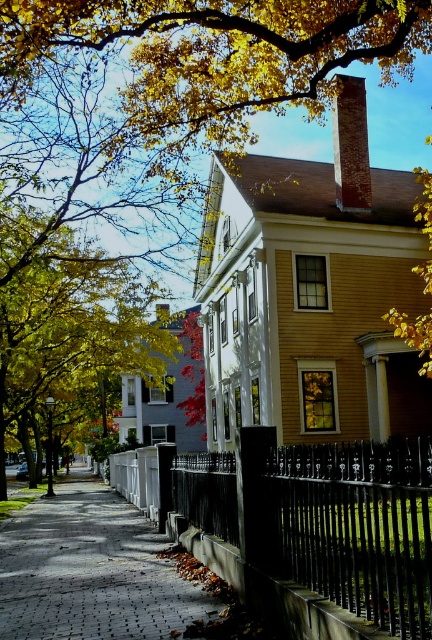
Question: Which point appears farthest from the camera in this image?

Choices:
 (A) (25, 216)
 (B) (47, 620)

Answer: (A)

Question: Is golden leafy tree at upper left below yellow-green foliage at center?

Choices:
 (A) no
 (B) yes

Answer: (A)

Question: Does golden leafy tree at upper left appear under paved brick sidewalk at center?

Choices:
 (A) no
 (B) yes

Answer: (A)

Question: Which of these objects is positioned farthest from the yellow-green foliage at center?

Choices:
 (A) golden leafy tree at upper left
 (B) brick chimney at upper right

Answer: (B)

Question: Is paved brick sidewalk at center to the right of brick chimney at upper right from the viewer's perspective?

Choices:
 (A) no
 (B) yes

Answer: (A)

Question: Among these points, which one is nearest to the camera?

Choices:
 (A) 73,524
 (B) 57,285
 (C) 314,552

Answer: (C)